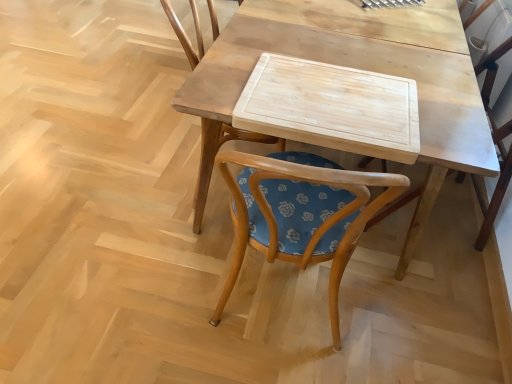
Describe the element at coordinates (356, 68) in the screenshot. Image resolution: width=512 pixels, height=384 pixels. I see `wooden cutting board at center` at that location.

In order to face wooden cutting board at center, should I rotate leftwards or rightwards?

To face it directly, rotate right by 10.538 degrees.

The image size is (512, 384). Describe the element at coordinates (497, 145) in the screenshot. I see `wooden chair at center, arranged as the 1th chair when viewed from the right` at that location.

In order to face wooden chair at center, the second chair viewed from the right, should I rotate leftwards or rightwards?

Turn left approximately 2.362 degrees to face it.

The height and width of the screenshot is (384, 512). What are the coordinates of `wooden cutting board at center` in the screenshot? It's located at 356,68.

Which object is more forward, wooden chair at center, positioned as the 2th chair in left-to-right order, or wooden chair at center, the second chair viewed from the right?

wooden chair at center, the second chair viewed from the right, is in front.

In terms of width, does wooden chair at center, positioned as the 2th chair in left-to-right order, look wider or thinner when compared to wooden chair at center, the second chair viewed from the right?

wooden chair at center, positioned as the 2th chair in left-to-right order, is thinner than wooden chair at center, the second chair viewed from the right.

Looking at this image, from the image's perspective, which is above, wooden chair at center, arranged as the 1th chair when viewed from the right, or wooden chair at center, which is counted as the first chair, starting from the left?

wooden chair at center, which is counted as the first chair, starting from the left.

From a real-world perspective, is wooden chair at center, arranged as the 1th chair when viewed from the right, physically above wooden chair at center, the second chair viewed from the right?

Actually, wooden chair at center, arranged as the 1th chair when viewed from the right, is physically below wooden chair at center, the second chair viewed from the right, in the real world.

Considering the relative positions of wooden chair at center, arranged as the 1th chair when viewed from the right, and wooden cutting board at center in the image provided, is wooden chair at center, arranged as the 1th chair when viewed from the right, behind wooden cutting board at center?

Yes, it is behind wooden cutting board at center.

Considering the sizes of objects wooden chair at center, arranged as the 1th chair when viewed from the right, and wooden cutting board at center in the image provided, who is shorter, wooden chair at center, arranged as the 1th chair when viewed from the right, or wooden cutting board at center?

Standing shorter between the two is wooden cutting board at center.

Which of these two, wooden chair at center, positioned as the 2th chair in left-to-right order, or wooden cutting board at center, is wider?

Wider between the two is wooden cutting board at center.

Is wooden chair at center, arranged as the 1th chair when viewed from the right, next to wooden cutting board at center and touching it?

wooden chair at center, arranged as the 1th chair when viewed from the right, and wooden cutting board at center are not in contact.

Looking at this image, considering the positions of objects natural wood cutting board at center and wooden chair at center, the second chair viewed from the right, in the image provided, who is more to the right, natural wood cutting board at center or wooden chair at center, the second chair viewed from the right,?

Positioned to the right is natural wood cutting board at center.

Is natural wood cutting board at center wider or thinner than wooden chair at center, the second chair viewed from the right?

Considering their sizes, natural wood cutting board at center looks slimmer than wooden chair at center, the second chair viewed from the right.

From the image's perspective, which is below, natural wood cutting board at center or wooden chair at center, which is counted as the first chair, starting from the left?

natural wood cutting board at center, from the image's perspective.

Considering the positions of point (262, 97) and point (209, 123), is point (262, 97) closer or farther from the camera than point (209, 123)?

Clearly, point (262, 97) is closer to the camera than point (209, 123).

Locate an element on the screen. This screenshot has width=512, height=384. table to the right of natural wood cutting board at center is located at coordinates (356, 68).

From a real-world perspective, between wooden cutting board at center and natural wood cutting board at center, who is vertically lower?

From a 3D spatial view, wooden cutting board at center is below.

From the image's perspective, would you say wooden cutting board at center is shown under natural wood cutting board at center?

Incorrect, from the image's perspective, wooden cutting board at center is higher than natural wood cutting board at center.

From the picture: Can you tell me how much wooden cutting board at center and natural wood cutting board at center differ in facing direction?

88.1 degrees.

Is there a large distance between wooden cutting board at center and wooden chair at center, positioned as the 2th chair in left-to-right order?

They are positioned close to each other.

Considering the positions of objects wooden cutting board at center and wooden chair at center, positioned as the 2th chair in left-to-right order, in the image provided, who is behind, wooden cutting board at center or wooden chair at center, positioned as the 2th chair in left-to-right order,?

Positioned behind is wooden chair at center, positioned as the 2th chair in left-to-right order.

Locate an element on the screen. Image resolution: width=512 pixels, height=384 pixels. chair on the right of wooden cutting board at center is located at coordinates (497, 145).

From the image's perspective, is wooden cutting board at center over wooden chair at center, positioned as the 2th chair in left-to-right order?

Yes.

Based on the photo, from the image's perspective, relative to wooden cutting board at center, is natural wood cutting board at center above or below?

natural wood cutting board at center is below wooden cutting board at center.

Is natural wood cutting board at center wider than wooden cutting board at center?

No, natural wood cutting board at center is not wider than wooden cutting board at center.

Can you confirm if natural wood cutting board at center is smaller than wooden cutting board at center?

Yes.

In the image, is natural wood cutting board at center on the left side or the right side of wooden cutting board at center?

natural wood cutting board at center is to the left of wooden cutting board at center.

Consider the image. Considering the relative positions of wooden chair at center, the second chair viewed from the right, and natural wood cutting board at center in the image provided, is wooden chair at center, the second chair viewed from the right, to the left of natural wood cutting board at center from the viewer's perspective?

Correct, you'll find wooden chair at center, the second chair viewed from the right, to the left of natural wood cutting board at center.

Find the location of a particular element. Image resolution: width=512 pixels, height=384 pixels. chair that is the 1st one when counting backward from the natural wood cutting board at center is located at coordinates (215, 155).

From the image's perspective, is wooden chair at center, the second chair viewed from the right, positioned above or below natural wood cutting board at center?

wooden chair at center, the second chair viewed from the right, is situated higher than natural wood cutting board at center in the image.

You are a GUI agent. You are given a task and a screenshot of the screen. Output one action in this format:
    pyautogui.click(x=<x>, y=<y>)
    Task: Click on the chair on the left of wooden chair at center, arranged as the 1th chair when viewed from the right
    Image resolution: width=512 pixels, height=384 pixels.
    Given the screenshot: What is the action you would take?
    215,155

You are a GUI agent. You are given a task and a screenshot of the screen. Output one action in this format:
    pyautogui.click(x=<x>, y=<y>)
    Task: Click on the table located underneath the wooden chair at center, arranged as the 1th chair when viewed from the right (from a real-world perspective)
    Image resolution: width=512 pixels, height=384 pixels.
    Given the screenshot: What is the action you would take?
    pyautogui.click(x=356, y=68)

Looking at the image, which one is located closer to wooden chair at center, which is counted as the first chair, starting from the left, wooden chair at center, positioned as the 2th chair in left-to-right order, or wooden cutting board at center?

Among the two, wooden cutting board at center is located nearer to wooden chair at center, which is counted as the first chair, starting from the left.

Estimate the real-world distances between objects in this image. Which object is further from wooden cutting board at center, natural wood cutting board at center or wooden chair at center, which is counted as the first chair, starting from the left?

wooden chair at center, which is counted as the first chair, starting from the left, lies further to wooden cutting board at center than the other object.

From the picture: Considering their positions, is natural wood cutting board at center positioned further to wooden chair at center, positioned as the 2th chair in left-to-right order, than wooden cutting board at center?

natural wood cutting board at center is further to wooden chair at center, positioned as the 2th chair in left-to-right order.

Based on their spatial positions, is wooden cutting board at center or natural wood cutting board at center further from wooden chair at center, which is counted as the first chair, starting from the left?

Based on the image, natural wood cutting board at center appears to be further to wooden chair at center, which is counted as the first chair, starting from the left.

Based on their spatial positions, is wooden chair at center, which is counted as the first chair, starting from the left, or wooden cutting board at center further from natural wood cutting board at center?

The object further to natural wood cutting board at center is wooden chair at center, which is counted as the first chair, starting from the left.

Estimate the real-world distances between objects in this image. Which object is closer to wooden chair at center, positioned as the 2th chair in left-to-right order, natural wood cutting board at center or wooden chair at center, which is counted as the first chair, starting from the left?

natural wood cutting board at center is positioned closer to the anchor wooden chair at center, positioned as the 2th chair in left-to-right order.

Based on their spatial positions, is wooden chair at center, which is counted as the first chair, starting from the left, or wooden chair at center, positioned as the 2th chair in left-to-right order, closer to wooden cutting board at center?

Among the two, wooden chair at center, positioned as the 2th chair in left-to-right order, is located nearer to wooden cutting board at center.

Which object lies further to the anchor point wooden chair at center, positioned as the 2th chair in left-to-right order, wooden chair at center, the second chair viewed from the right, or natural wood cutting board at center?

wooden chair at center, the second chair viewed from the right, lies further to wooden chair at center, positioned as the 2th chair in left-to-right order, than the other object.

Where is `plank situated between wooden chair at center, the second chair viewed from the right, and wooden chair at center, arranged as the 1th chair when viewed from the right, from left to right`? plank situated between wooden chair at center, the second chair viewed from the right, and wooden chair at center, arranged as the 1th chair when viewed from the right, from left to right is located at coordinates (331, 107).

The height and width of the screenshot is (384, 512). I want to click on table between wooden chair at center, which is counted as the first chair, starting from the left, and wooden chair at center, positioned as the 2th chair in left-to-right order, so click(356, 68).

Where is `plank between wooden chair at center, which is counted as the first chair, starting from the left, and wooden cutting board at center from left to right`? plank between wooden chair at center, which is counted as the first chair, starting from the left, and wooden cutting board at center from left to right is located at coordinates (331, 107).

This screenshot has width=512, height=384. What are the coordinates of `table located between natural wood cutting board at center and wooden chair at center, arranged as the 1th chair when viewed from the right, in the left-right direction` in the screenshot? It's located at (356, 68).